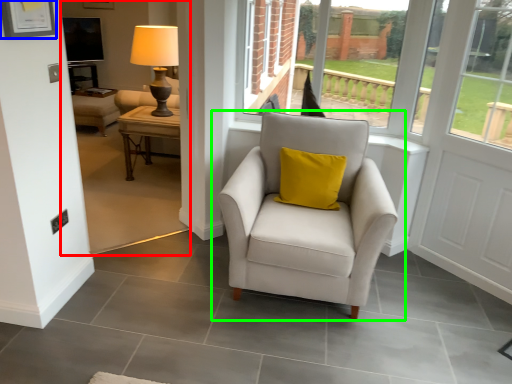
Question: Which object is the closest to the backyard (highlighted by a red box)? Choose among these: picture frame (highlighted by a blue box) or chair (highlighted by a green box).

Choices:
 (A) picture frame
 (B) chair

Answer: (B)